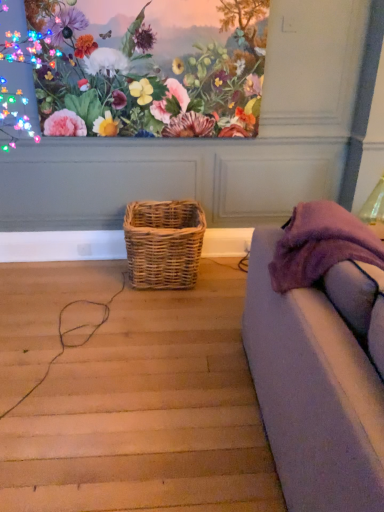
I want to click on free space to the left of purple fabric couch at right, so click(x=181, y=406).